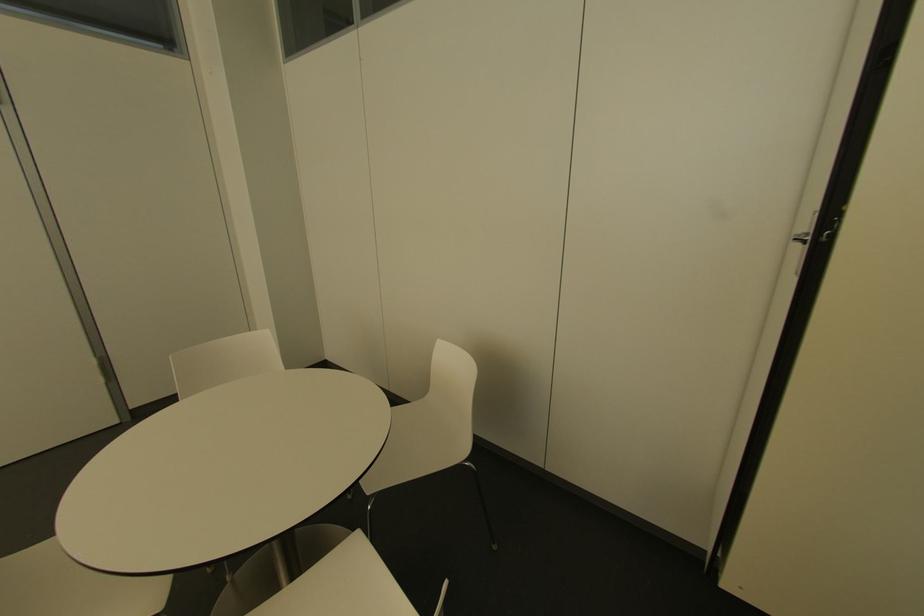
Locate an element on the screen. The width and height of the screenshot is (924, 616). white chair sitting surface is located at coordinates coord(420,442).